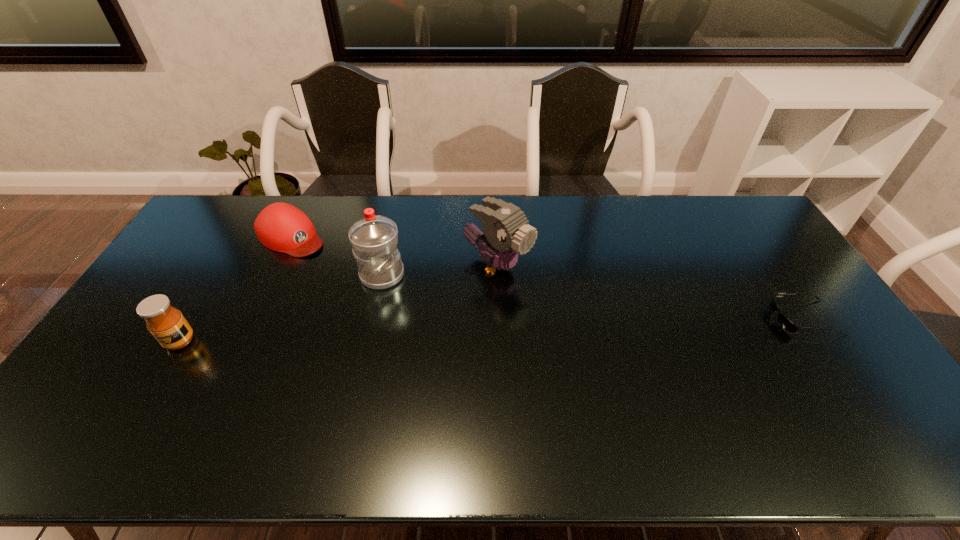
The image size is (960, 540). I want to click on the leftmost object, so click(x=166, y=323).

Find the location of `the third tallest object`. the third tallest object is located at coordinates (166, 323).

Locate an element on the screen. Image resolution: width=960 pixels, height=540 pixels. the shortest object is located at coordinates 784,322.

Locate an element on the screen. Image resolution: width=960 pixels, height=540 pixels. sunglasses is located at coordinates (784, 322).

Where is `water bottle`? This screenshot has width=960, height=540. water bottle is located at coordinates [x=374, y=238].

Where is `the second shortest object`? the second shortest object is located at coordinates (281, 227).

You are a GUI agent. You are given a task and a screenshot of the screen. Output one action in this format:
    pyautogui.click(x=<x>, y=<y>)
    Task: Click on the fourth object from right to left
    Image resolution: width=960 pixels, height=540 pixels.
    Given the screenshot: What is the action you would take?
    pyautogui.click(x=281, y=227)

The width and height of the screenshot is (960, 540). What are the coordinates of `the fourth object from left to right` in the screenshot? It's located at (507, 233).

Identify the location of vacant space located on the front-facing side of the leftmost object. The height and width of the screenshot is (540, 960). point(161,373).

Locate an element on the screen. This screenshot has width=960, height=540. vacant space situated on the front-facing side of the sunglasses is located at coordinates [x=647, y=318].